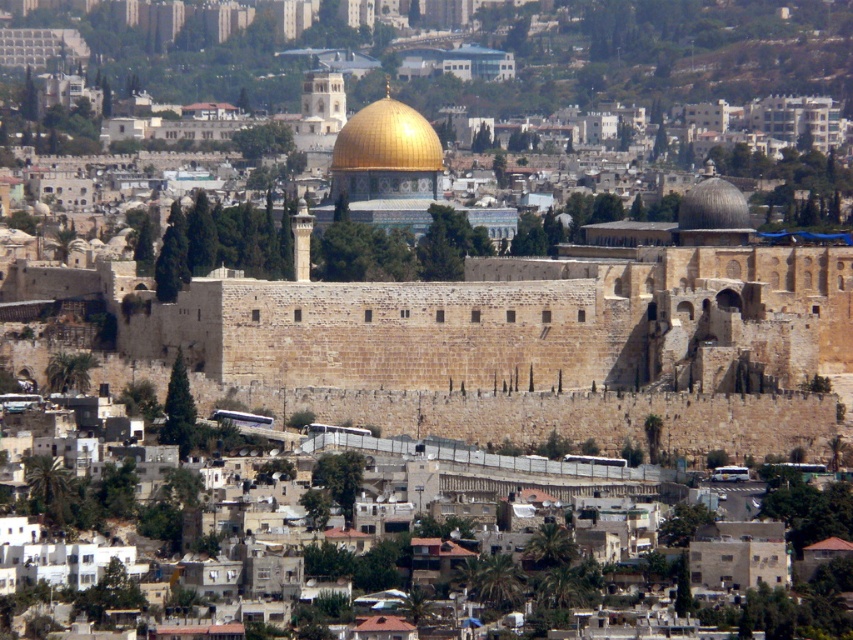
Question: Which point is farther to the camera?

Choices:
 (A) gold shiny dome at center
 (B) smooth stone dome at upper right

Answer: (A)

Question: Does gold shiny dome at center have a greater width compared to smooth stone dome at upper right?

Choices:
 (A) no
 (B) yes

Answer: (A)

Question: Can you confirm if gold shiny dome at center is positioned above smooth stone dome at upper right?

Choices:
 (A) no
 (B) yes

Answer: (B)

Question: Can you confirm if gold shiny dome at center is positioned to the right of smooth stone dome at upper right?

Choices:
 (A) yes
 (B) no

Answer: (B)

Question: Which point is farther to the camera?

Choices:
 (A) (403, 141)
 (B) (724, 220)

Answer: (A)